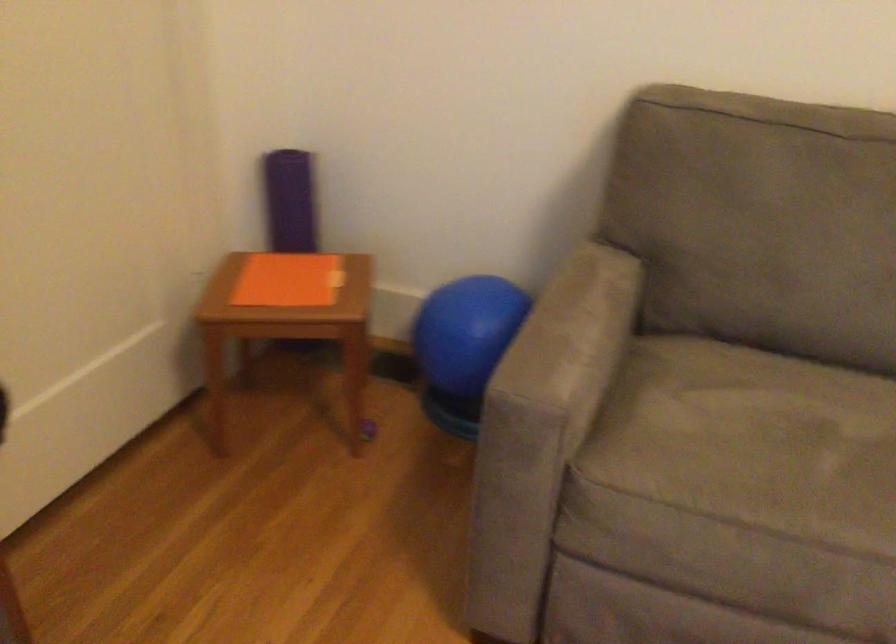
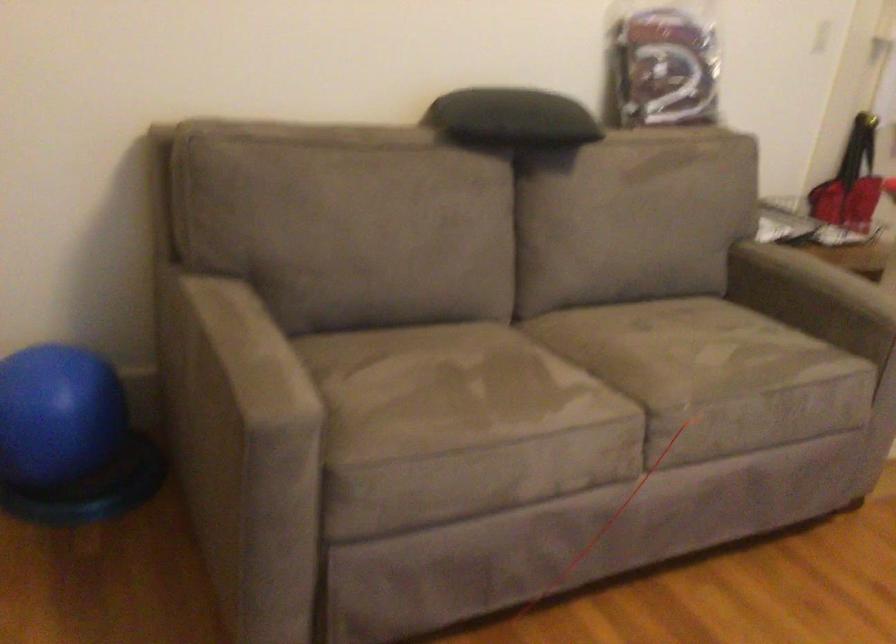
Question: The first image is from the beginning of the video and the second image is from the end. How did the camera likely rotate when shooting the video?

Choices:
 (A) Left
 (B) Right
 (C) Up
 (D) Down

Answer: (B)